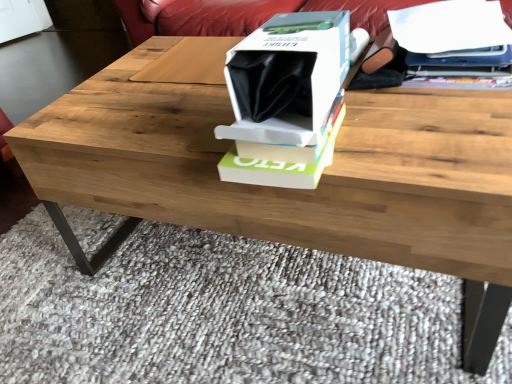
In order to click on free space above white cardboard box at center (from a real-world perspective) in this screenshot , I will do `click(288, 34)`.